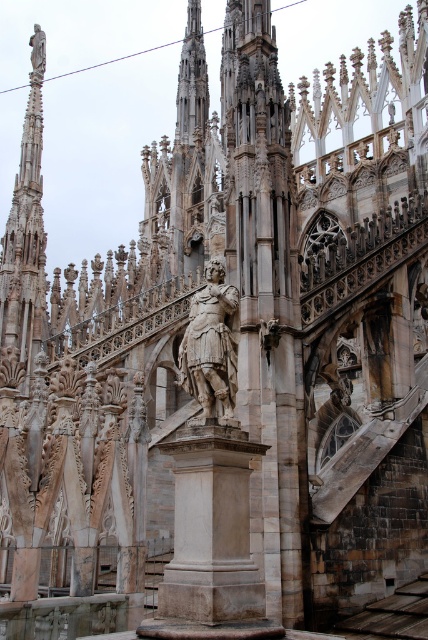
You are standing in front of the cathedral and want to take a photo that includes both the polished stone spire at upper left and the polished bronze statue at center. Which object should you position to the left side of your camera frame to ensure both are visible?

You should position the polished stone spire at upper left to the left side of your camera frame because it is already located to the left of the polished bronze statue at center, ensuring both will be captured in the photo.

You are an architect examining the cathedral design. You notice a specific point at coordinates point (26, 230). Based on the cathedral structure, what architectural element does this point likely represent?

The point (26, 230) corresponds to the polished stone spire at upper left.

You are an architect examining the cathedral. You notice the polished stone spire at upper left and the polished bronze statue at center. Which of these two objects is positioned higher in the image?

The polished stone spire at upper left is located above the polished bronze statue at center, so it is positioned higher.